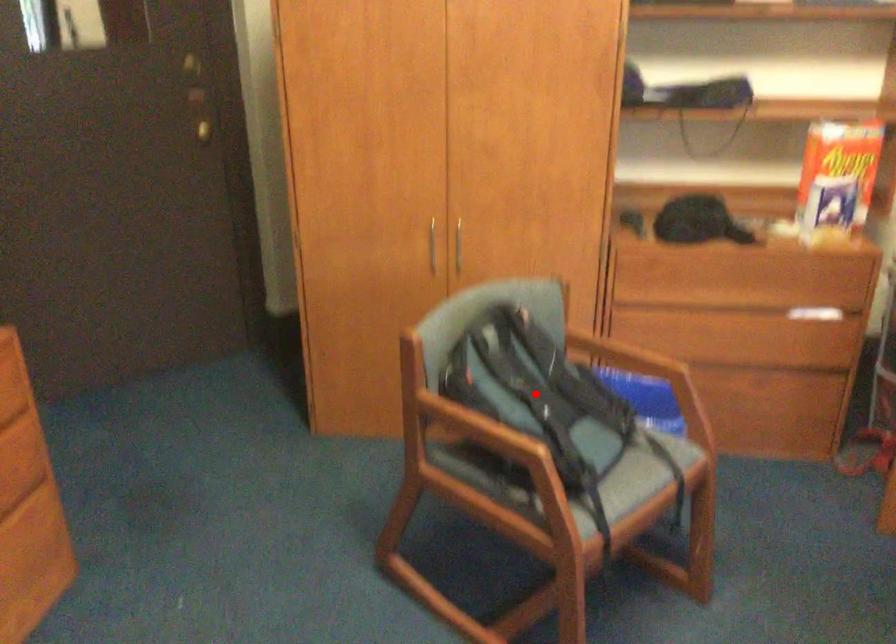
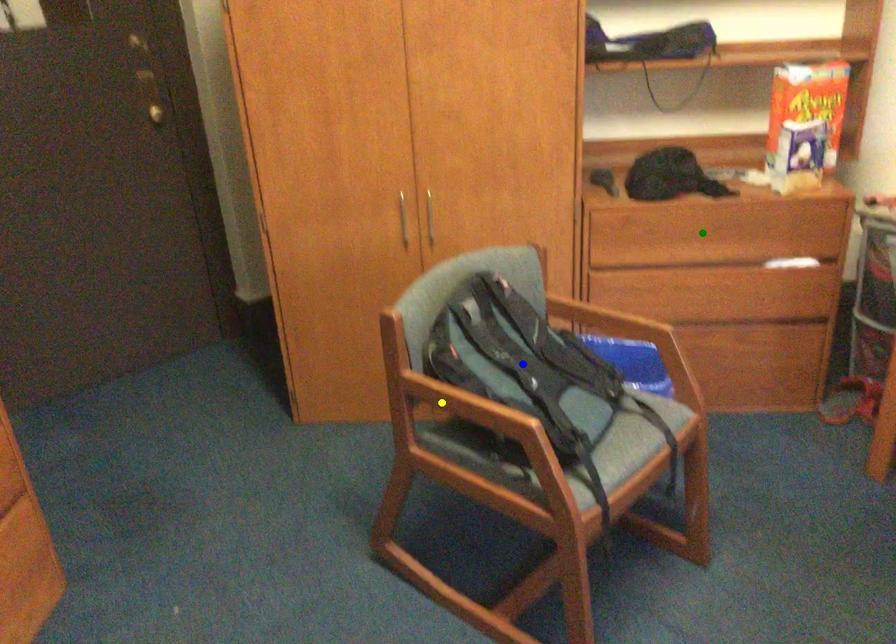
Question: I am providing you with two images of the same scene from different viewpoints. A red point is marked on the first image. You are given multiple points on the second image. Can you choose the point in image 2 that corresponds to the point in image 1?

Choices:
 (A) yellow point
 (B) blue point
 (C) green point

Answer: (B)